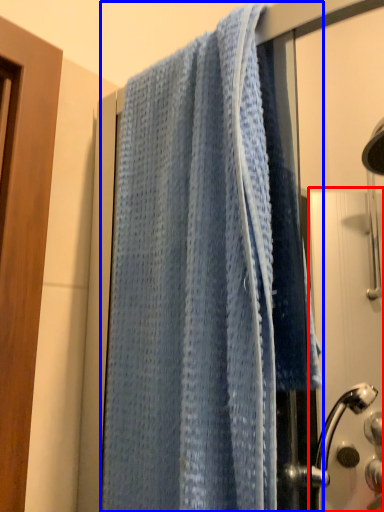
Question: Which object appears closest to the camera in this image, screen door (highlighted by a red box) or towel (highlighted by a blue box)?

Choices:
 (A) screen door
 (B) towel

Answer: (B)